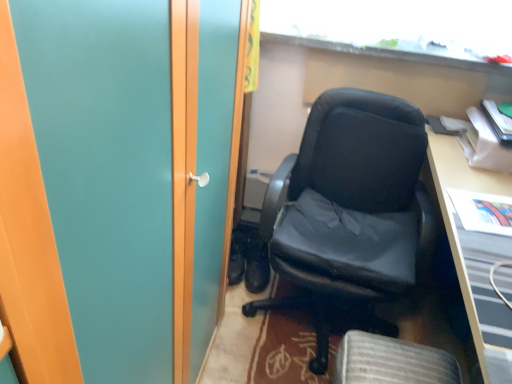
Measure the distance between point [257,249] and camera.

6.75 feet.

Where is `wooden desk at right`? wooden desk at right is located at coordinates (476, 246).

You are a GUI agent. You are given a task and a screenshot of the screen. Output one action in this format:
    pyautogui.click(x=<x>, y=<y>)
    Task: Click on the black leather swivel chair at lower center
    The height and width of the screenshot is (384, 512).
    Given the screenshot: What is the action you would take?
    pyautogui.click(x=391, y=362)

The width and height of the screenshot is (512, 384). Describe the element at coordinates (349, 207) in the screenshot. I see `black leather chair at center` at that location.

Find the location of `transparent glass window at upper center`. transparent glass window at upper center is located at coordinates (400, 29).

Can you confirm if black leather swivel chair at lower center is taller than black leather shoes at center, which ranks as the second footwear in left-to-right order?

Yes.

Is black leather swivel chair at lower center positioned with its back to black leather shoes at center, which ranks as the second footwear in left-to-right order?

No, black leather swivel chair at lower center is not facing away from black leather shoes at center, which ranks as the second footwear in left-to-right order.

From a real-world perspective, count 1st footwears downward from the black leather swivel chair at lower center and point to it. Please provide its 2D coordinates.

[(256, 265)]

Is point (247, 282) closer or farther from the camera than point (482, 199)?

Point (247, 282) is positioned farther from the camera compared to point (482, 199).

Can you confirm if black leather shoes at center, which ranks as the second footwear in left-to-right order, is smaller than wooden desk at right?

Indeed, black leather shoes at center, which ranks as the second footwear in left-to-right order, has a smaller size compared to wooden desk at right.

Considering the relative positions of black leather shoes at center, marked as the 1th footwear in a right-to-left arrangement, and wooden desk at right in the image provided, is black leather shoes at center, marked as the 1th footwear in a right-to-left arrangement, in front of wooden desk at right?

No, it is behind wooden desk at right.

Between black leather shoes at center, marked as the 1th footwear in a right-to-left arrangement, and black leather shoes at center, which ranks as the 1th footwear in left-to-right order, which one has smaller size?

With smaller size is black leather shoes at center, which ranks as the 1th footwear in left-to-right order.

Does black leather shoes at center, which ranks as the second footwear in left-to-right order, have a lesser height compared to black leather shoes at center, which ranks as the 1th footwear in left-to-right order?

No, black leather shoes at center, which ranks as the second footwear in left-to-right order, is not shorter than black leather shoes at center, which ranks as the 1th footwear in left-to-right order.

From a real-world perspective, is black leather shoes at center, marked as the 1th footwear in a right-to-left arrangement, located higher than black leather shoes at center, the 2th footwear when ordered from right to left?

Yes, from a real-world perspective, black leather shoes at center, marked as the 1th footwear in a right-to-left arrangement, is on top of black leather shoes at center, the 2th footwear when ordered from right to left.

Which is nearer, (260, 279) or (231, 254)?

The point (260, 279) is in front.

Can you confirm if wooden desk at right is positioned to the right of transparent glass window at upper center?

Indeed, wooden desk at right is positioned on the right side of transparent glass window at upper center.

Considering the relative positions of wooden desk at right and transparent glass window at upper center in the image provided, is wooden desk at right behind transparent glass window at upper center?

That is False.

Is wooden desk at right thinner than transparent glass window at upper center?

No.

Is wooden desk at right beside transparent glass window at upper center?

No.

Which point is more distant from viewer, (495, 179) or (244, 262)?

The point (244, 262) is behind.

Based on their positions, is wooden desk at right located to the left or right of black leather shoes at center, which ranks as the 1th footwear in left-to-right order?

wooden desk at right is positioned on black leather shoes at center, which ranks as the 1th footwear in left-to-right order,'s right side.

Based on the photo, is wooden desk at right surrounding black leather shoes at center, which ranks as the 1th footwear in left-to-right order?

Actually, black leather shoes at center, which ranks as the 1th footwear in left-to-right order, is outside wooden desk at right.

From a real-world perspective, is black leather shoes at center, the 2th footwear when ordered from right to left, physically located above or below transparent glass window at upper center?

black leather shoes at center, the 2th footwear when ordered from right to left, is below transparent glass window at upper center.

Which of these two, black leather shoes at center, the 2th footwear when ordered from right to left, or transparent glass window at upper center, stands shorter?

transparent glass window at upper center.

Considering the relative sizes of black leather shoes at center, which ranks as the 1th footwear in left-to-right order, and transparent glass window at upper center in the image provided, is black leather shoes at center, which ranks as the 1th footwear in left-to-right order, bigger than transparent glass window at upper center?

Incorrect, black leather shoes at center, which ranks as the 1th footwear in left-to-right order, is not larger than transparent glass window at upper center.

Which is behind, point (239, 246) or point (276, 4)?

The point (239, 246) is farther from the camera.

Consider the image. Is black leather chair at center wider or thinner than wooden desk at right?

In the image, black leather chair at center appears to be wider than wooden desk at right.

From a real-world perspective, does black leather chair at center sit lower than wooden desk at right?

Yes, from a real-world perspective, black leather chair at center is beneath wooden desk at right.

In the image, is black leather chair at center positioned in front of or behind wooden desk at right?

Clearly, black leather chair at center is behind wooden desk at right.

From the image's perspective, is black leather chair at center above wooden desk at right?

Correct, black leather chair at center appears higher than wooden desk at right in the image.

At what (x,y) coordinates should I click in order to perform the action: click on swivel chair lying in front of the black leather shoes at center, which ranks as the second footwear in left-to-right order. Please return your answer as a coordinate pair (x, y). Looking at the image, I should click on (391, 362).

From a real-world perspective, count 1st footwears downward from the wooden desk at right and point to it. Please provide its 2D coordinates.

[(256, 265)]

Based on their spatial positions, is transparent glass window at upper center or black leather chair at center further from black leather swivel chair at lower center?

Among the two, transparent glass window at upper center is located further to black leather swivel chair at lower center.

From the image, which object appears to be farther from wooden desk at right, black leather swivel chair at lower center or black leather shoes at center, marked as the 1th footwear in a right-to-left arrangement?

Based on the image, black leather shoes at center, marked as the 1th footwear in a right-to-left arrangement, appears to be further to wooden desk at right.

Estimate the real-world distances between objects in this image. Which object is further from black leather shoes at center, which ranks as the 1th footwear in left-to-right order, black leather shoes at center, marked as the 1th footwear in a right-to-left arrangement, or black leather swivel chair at lower center?

black leather swivel chair at lower center is further to black leather shoes at center, which ranks as the 1th footwear in left-to-right order.

From the picture: Based on their spatial positions, is wooden desk at right or black leather shoes at center, the 2th footwear when ordered from right to left, further from black leather shoes at center, which ranks as the second footwear in left-to-right order?

Based on the image, wooden desk at right appears to be further to black leather shoes at center, which ranks as the second footwear in left-to-right order.

Based on their spatial positions, is black leather swivel chair at lower center or black leather shoes at center, the 2th footwear when ordered from right to left, closer to black leather chair at center?

Based on the image, black leather swivel chair at lower center appears to be nearer to black leather chair at center.

Which object lies nearer to the anchor point wooden desk at right, black leather chair at center or black leather swivel chair at lower center?

Among the two, black leather chair at center is located nearer to wooden desk at right.

Which object lies nearer to the anchor point black leather shoes at center, which ranks as the second footwear in left-to-right order, black leather chair at center or transparent glass window at upper center?

The object closer to black leather shoes at center, which ranks as the second footwear in left-to-right order, is black leather chair at center.

Estimate the real-world distances between objects in this image. Which object is closer to wooden desk at right, transparent glass window at upper center or black leather shoes at center, marked as the 1th footwear in a right-to-left arrangement?

transparent glass window at upper center is closer to wooden desk at right.

Find the location of a particular element. The image size is (512, 384). footwear between wooden desk at right and black leather shoes at center, which ranks as the 1th footwear in left-to-right order, from front to back is located at coordinates (256, 265).

This screenshot has height=384, width=512. What are the coordinates of `swivel chair between black leather chair at center and black leather shoes at center, the 2th footwear when ordered from right to left, from front to back` in the screenshot? It's located at (391, 362).

At what (x,y) coordinates should I click in order to perform the action: click on chair between wooden desk at right and black leather swivel chair at lower center along the z-axis. Please return your answer as a coordinate pair (x, y). The image size is (512, 384). Looking at the image, I should click on (349, 207).

Find the location of a particular element. swivel chair between black leather chair at center and black leather shoes at center, marked as the 1th footwear in a right-to-left arrangement, from front to back is located at coordinates (391, 362).